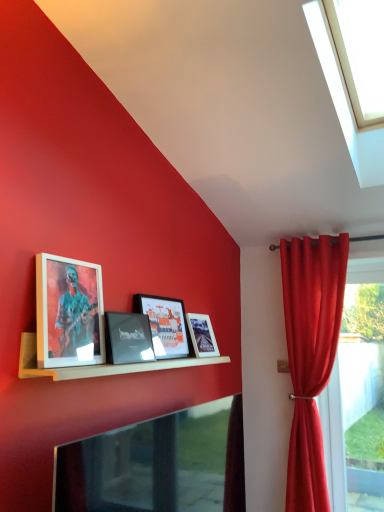
The height and width of the screenshot is (512, 384). Describe the element at coordinates (346, 106) in the screenshot. I see `transparent glass window at upper right` at that location.

Find the location of `matte white picture frame at center, the first picture frame positioned from the back`. matte white picture frame at center, the first picture frame positioned from the back is located at coordinates (202, 335).

Describe the element at coordinates (358, 395) in the screenshot. This screenshot has width=384, height=512. I see `transparent glass window at right` at that location.

What do you see at coordinates (157, 464) in the screenshot? This screenshot has height=512, width=384. I see `metallic glossy tv at lower center` at bounding box center [157, 464].

You are a GUI agent. You are given a task and a screenshot of the screen. Output one action in this format:
    pyautogui.click(x=<x>, y=<y>)
    Task: Click on the transparent glass window at upper right
    
    Given the screenshot: What is the action you would take?
    pyautogui.click(x=346, y=106)

Find the location of `window behind the wooden shelf at center`. window behind the wooden shelf at center is located at coordinates (346, 106).

Is wooden shelf at center far from transparent glass window at upper right?

Yes, wooden shelf at center and transparent glass window at upper right are located far from each other.

Does wooden shelf at center have a smaller size compared to transparent glass window at upper right?

Correct, wooden shelf at center occupies less space than transparent glass window at upper right.

Is wooden shelf at center taller or shorter than transparent glass window at upper right?

Clearly, wooden shelf at center is shorter compared to transparent glass window at upper right.

Are transparent glass window at upper right and wooden shelf at center located far from each other?

transparent glass window at upper right is far away from wooden shelf at center.

Which is more to the right, transparent glass window at upper right or wooden shelf at center?

Positioned to the right is transparent glass window at upper right.

Does point (359, 155) appear closer or farther from the camera than point (185, 364)?

Point (359, 155).

The width and height of the screenshot is (384, 512). Identify the location of curtain to the left of transparent glass window at upper right. (311, 355).

From a real-world perspective, is transparent glass window at upper right beneath velvet red curtain at right?

No, from a real-world perspective, transparent glass window at upper right is not below velvet red curtain at right.

Which object is wider, transparent glass window at upper right or velvet red curtain at right?

transparent glass window at upper right.

Would you say transparent glass window at upper right is a long distance from velvet red curtain at right?

Yes, transparent glass window at upper right is far from velvet red curtain at right.

Is wooden framed picture at upper left, the first picture frame positioned from the front, positioned beyond the bounds of velvet red curtain at right?

Indeed, wooden framed picture at upper left, the first picture frame positioned from the front, is completely outside velvet red curtain at right.

Considering the relative sizes of wooden framed picture at upper left, placed as the 4th picture frame when sorted from back to front, and velvet red curtain at right in the image provided, is wooden framed picture at upper left, placed as the 4th picture frame when sorted from back to front, taller than velvet red curtain at right?

No.

From the image's perspective, which one is positioned higher, wooden framed picture at upper left, placed as the 4th picture frame when sorted from back to front, or velvet red curtain at right?

wooden framed picture at upper left, placed as the 4th picture frame when sorted from back to front, appears higher in the image.

Between wooden framed picture at upper left, the first picture frame positioned from the front, and velvet red curtain at right, which one is positioned behind?

velvet red curtain at right.

Where is `the 2nd picture frame above the velvet red curtain at right (from the image's perspective)`? The image size is (384, 512). the 2nd picture frame above the velvet red curtain at right (from the image's perspective) is located at coordinates pyautogui.click(x=166, y=325).

Considering the sizes of matte glass picture frame at center, which is the second picture frame from back to front, and velvet red curtain at right in the image, is matte glass picture frame at center, which is the second picture frame from back to front, bigger or smaller than velvet red curtain at right?

Clearly, matte glass picture frame at center, which is the second picture frame from back to front, is smaller in size than velvet red curtain at right.

Visually, is matte glass picture frame at center, which is the second picture frame from back to front, positioned to the left or to the right of velvet red curtain at right?

From the image, it's evident that matte glass picture frame at center, which is the second picture frame from back to front, is to the left of velvet red curtain at right.

Is matte glass picture frame at center, which is the second picture frame from back to front, placed right next to velvet red curtain at right?

They are not placed beside each other.

In terms of size, does matte black picture frame at center, which is the 2th picture frame from front to back, appear bigger or smaller than wooden shelf at center?

Considering their sizes, matte black picture frame at center, which is the 2th picture frame from front to back, takes up less space than wooden shelf at center.

Which is more to the right, matte black picture frame at center, the third picture frame from the back, or wooden shelf at center?

Positioned to the right is wooden shelf at center.

From a real-world perspective, who is located higher, matte black picture frame at center, which is the 2th picture frame from front to back, or wooden shelf at center?

From a 3D spatial view, matte black picture frame at center, which is the 2th picture frame from front to back, is above.

From a real-world perspective, is wooden framed picture at upper left, the first picture frame positioned from the front, below transparent glass window at upper right?

Yes, from a real-world perspective, wooden framed picture at upper left, the first picture frame positioned from the front, is below transparent glass window at upper right.

Is wooden framed picture at upper left, placed as the 4th picture frame when sorted from back to front, not near transparent glass window at upper right?

That's right, there is a large distance between wooden framed picture at upper left, placed as the 4th picture frame when sorted from back to front, and transparent glass window at upper right.

Identify the location of the 4th picture frame counting from the left of the transparent glass window at upper right. The image size is (384, 512). (68, 312).

Is wooden framed picture at upper left, the first picture frame positioned from the front, to the right of transparent glass window at upper right from the viewer's perspective?

Incorrect, wooden framed picture at upper left, the first picture frame positioned from the front, is not on the right side of transparent glass window at upper right.

This screenshot has height=512, width=384. In order to click on window to the right of wooden shelf at center in this screenshot , I will do `click(346, 106)`.

The height and width of the screenshot is (512, 384). What are the coordinates of `shelf beneath the transparent glass window at upper right (from a real-world perspective)` in the screenshot? It's located at (99, 365).

Which object lies further to the anchor point matte white picture frame at center, the first picture frame positioned from the back, transparent glass window at right or wooden framed picture at upper left, placed as the 4th picture frame when sorted from back to front?

transparent glass window at right.

Looking at the image, which one is located further to transparent glass window at upper right, matte white picture frame at center, the first picture frame positioned from the back, or transparent glass window at right?

The object further to transparent glass window at upper right is transparent glass window at right.

From the image, which object appears to be nearer to metallic glossy tv at lower center, wooden framed picture at upper left, placed as the 4th picture frame when sorted from back to front, or transparent glass window at upper right?

Among the two, wooden framed picture at upper left, placed as the 4th picture frame when sorted from back to front, is located nearer to metallic glossy tv at lower center.

When comparing their distances from wooden shelf at center, does velvet red curtain at right or metallic glossy tv at lower center seem further?

velvet red curtain at right is positioned further to the anchor wooden shelf at center.

Which object lies further to the anchor point matte white picture frame at center, which appears as the 4th picture frame when viewed from the front, velvet red curtain at right or transparent glass window at right?

Based on the image, transparent glass window at right appears to be further to matte white picture frame at center, which appears as the 4th picture frame when viewed from the front.

Estimate the real-world distances between objects in this image. Which object is closer to transparent glass window at upper right, metallic glossy tv at lower center or velvet red curtain at right?

Based on the image, velvet red curtain at right appears to be nearer to transparent glass window at upper right.

Estimate the real-world distances between objects in this image. Which object is further from velvet red curtain at right, transparent glass window at upper right or matte black picture frame at center, the third picture frame from the back?

matte black picture frame at center, the third picture frame from the back, is positioned further to the anchor velvet red curtain at right.

When comparing their distances from wooden framed picture at upper left, placed as the 4th picture frame when sorted from back to front, does transparent glass window at right or matte black picture frame at center, which is the 2th picture frame from front to back, seem further?

transparent glass window at right is positioned further to the anchor wooden framed picture at upper left, placed as the 4th picture frame when sorted from back to front.

The height and width of the screenshot is (512, 384). Find the location of `shelf between transparent glass window at upper right and metallic glossy tv at lower center in the up-down direction`. shelf between transparent glass window at upper right and metallic glossy tv at lower center in the up-down direction is located at coordinates (99, 365).

Locate an element on the screen. television situated between wooden framed picture at upper left, the first picture frame positioned from the front, and transparent glass window at right from left to right is located at coordinates (157, 464).

Where is `curtain between transparent glass window at upper right and metallic glossy tv at lower center from top to bottom`? The width and height of the screenshot is (384, 512). curtain between transparent glass window at upper right and metallic glossy tv at lower center from top to bottom is located at coordinates (311, 355).

Image resolution: width=384 pixels, height=512 pixels. I want to click on shelf between transparent glass window at upper right and velvet red curtain at right from top to bottom, so click(99, 365).